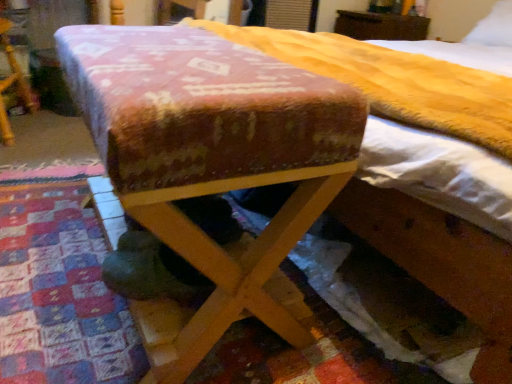
At what (x,y) coordinates should I click in order to perform the action: click on vacant space positioned to the left of velvet-like fabric ottoman at center, acting as the 3th furniture starting from the top. Please return your answer as a coordinate pair (x, y). Looking at the image, I should click on (46, 231).